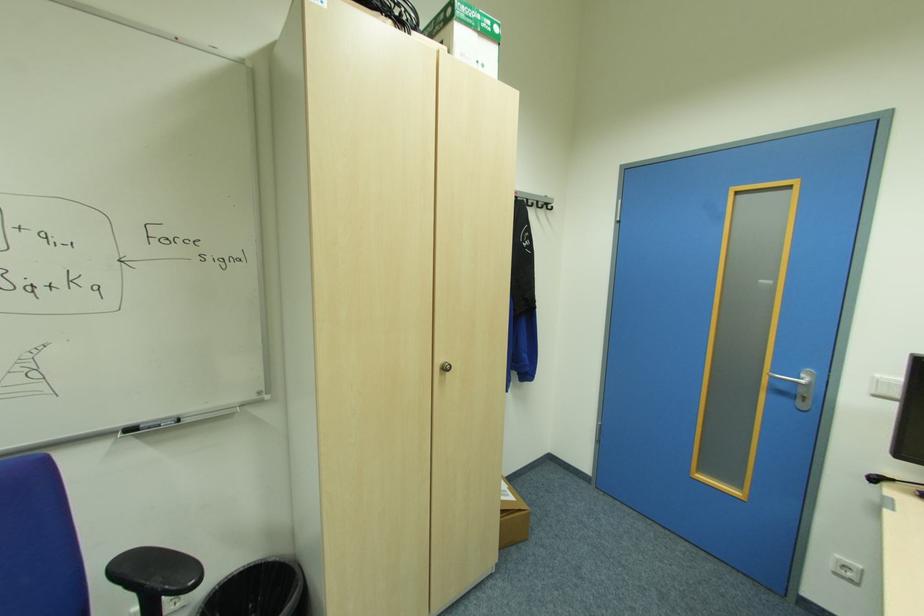
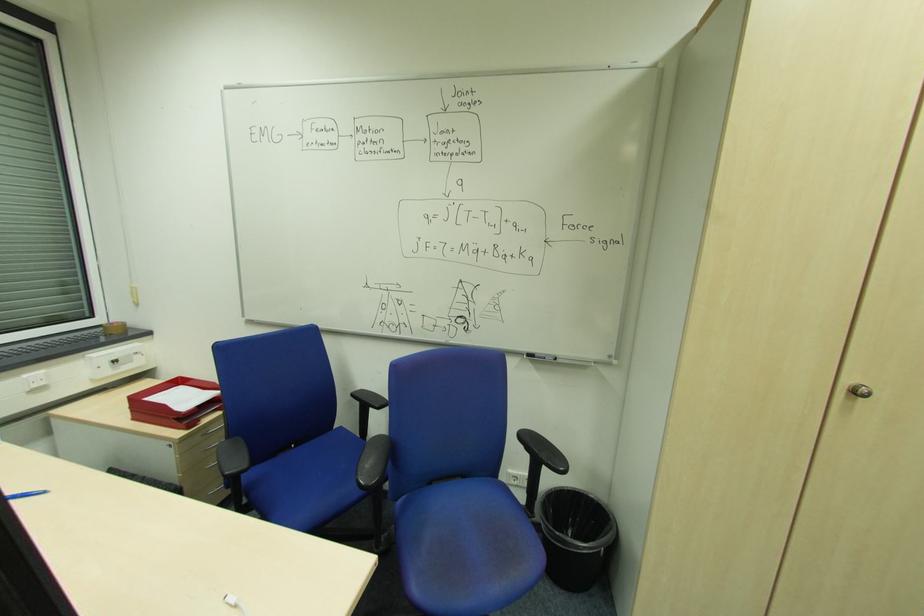
Question: How did the camera likely rotate?

Choices:
 (A) Left
 (B) Right
 (C) Up
 (D) Down

Answer: (A)